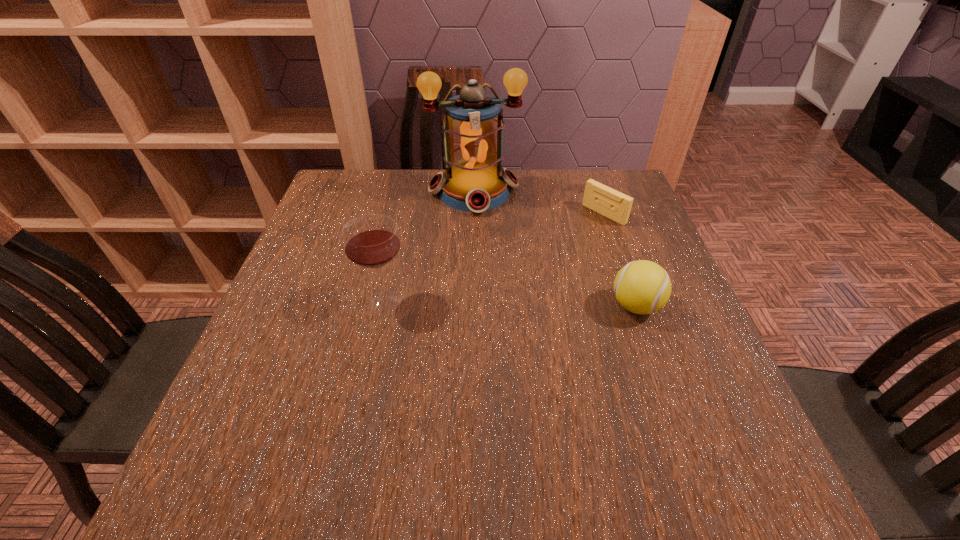
Where is `free spot on the desktop that is between the leftmost object and the tennis ball and is positioned at the front of the videotape with spools`? free spot on the desktop that is between the leftmost object and the tennis ball and is positioned at the front of the videotape with spools is located at coordinates (474, 302).

Where is `vacant space on the desktop that is between the third shortest object and the tennis ball and is positioned on the front-facing side of the third object from right to left`? This screenshot has height=540, width=960. vacant space on the desktop that is between the third shortest object and the tennis ball and is positioned on the front-facing side of the third object from right to left is located at coordinates (494, 303).